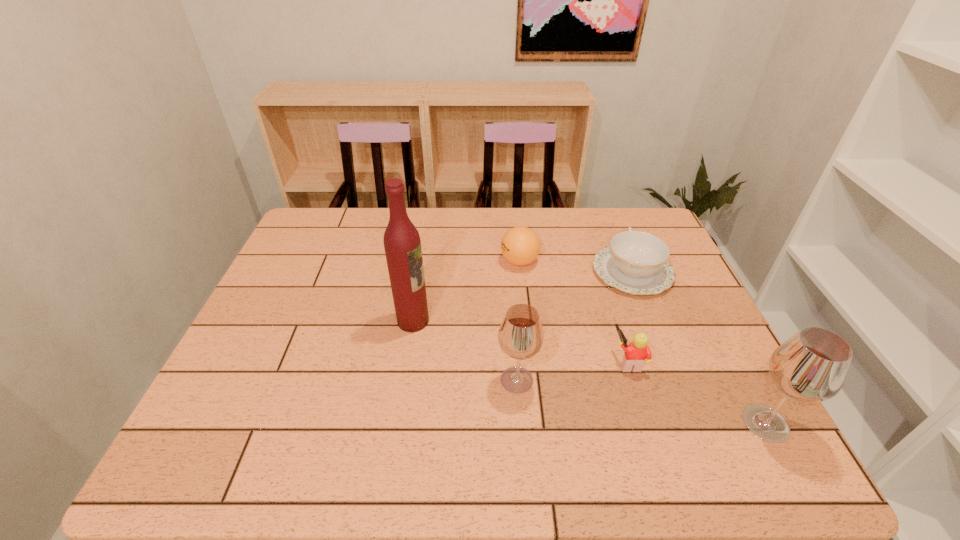
Locate an element on the screen. vacant spot to place a wineglass on the left is located at coordinates pos(306,343).